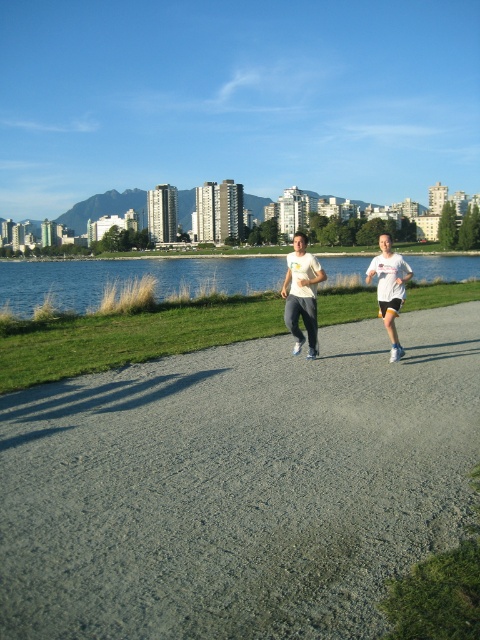
You are a runner planning to jog along the gray asphalt path at center while wearing the white matte shirt at center. Considering the size difference between the two, will you be able to comfortably jog on the path without the shirt restricting your movement?

The gray asphalt path at center is larger in size than the white matte shirt at center, so there should be enough space for you to comfortably jog on the path without the shirt restricting your movement.

You are a photographer trying to capture the joggers in the scene. Since the blue water at center and the white matte shirt at center are both in the frame, which one appears taller from your camera perspective?

The blue water at center appears taller than the white matte shirt at center because it has a greater height compared to it according to the description.

You are a runner preparing to jog along the gray asphalt path at center. You notice a white matte shirt at center nearby. Which object is wider in this scene?

The gray asphalt path at center is wider than the white matte shirt at center according to the description.